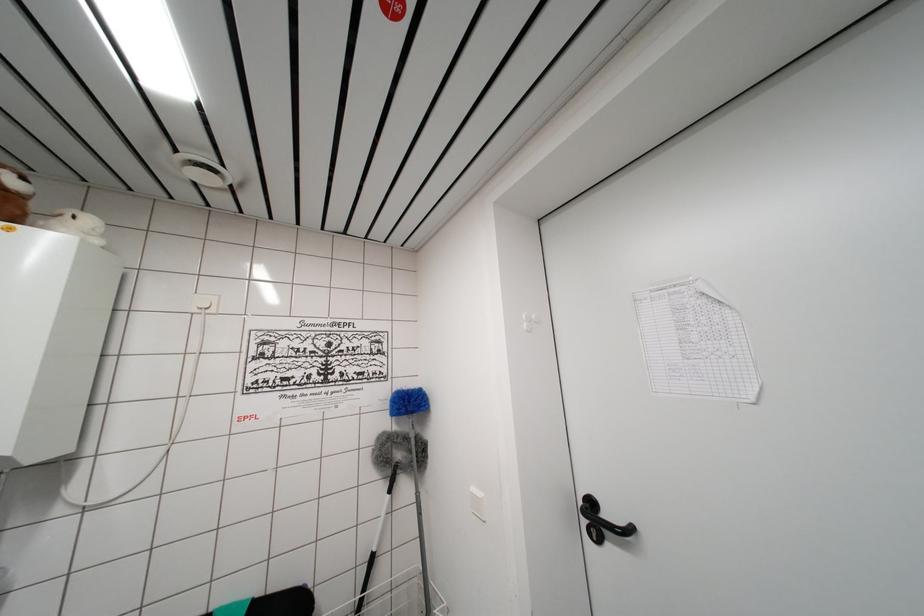
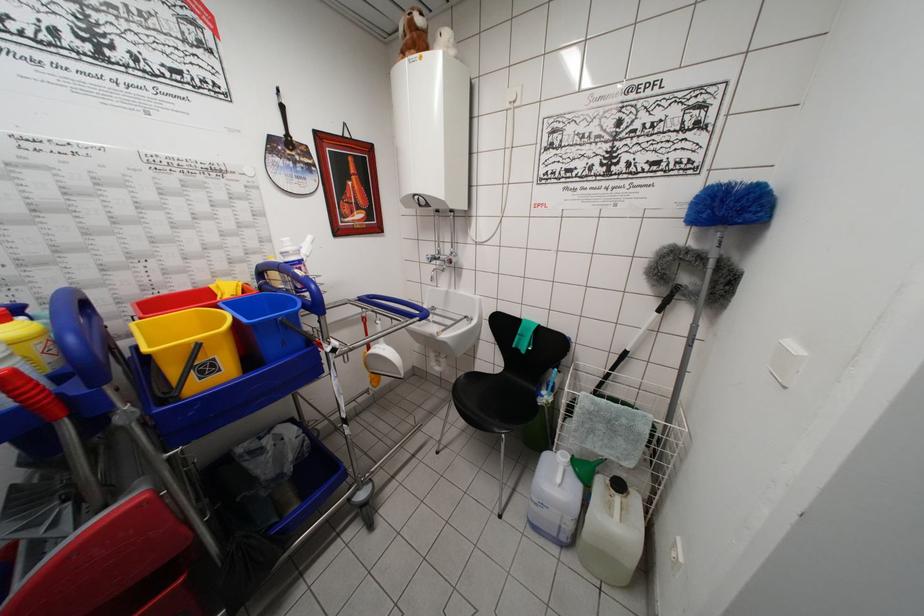
In the second image, find the point that corresponds to point (371, 564) in the first image.

(624, 358)